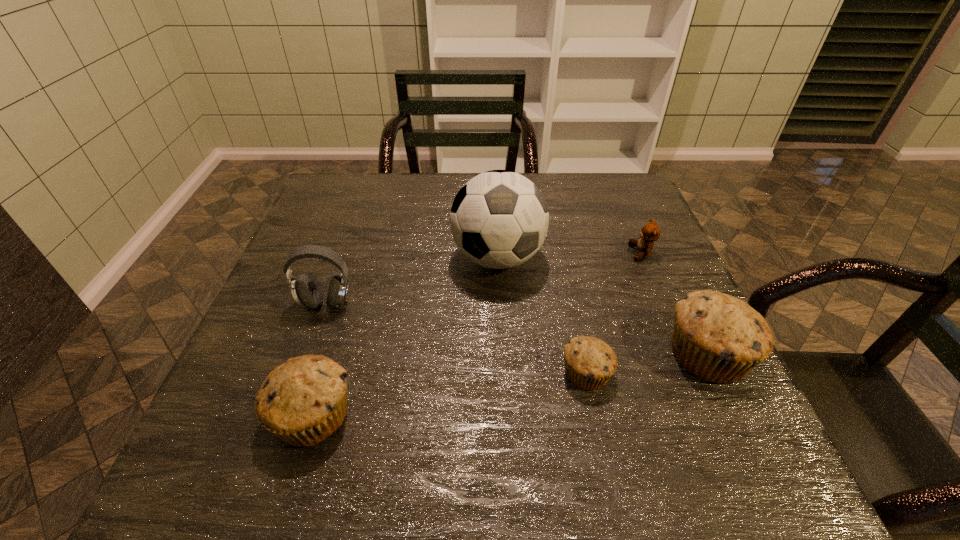
In order to click on the fourth tallest object in this screenshot , I will do `click(303, 401)`.

At what (x,y) coordinates should I click in order to perform the action: click on the second shortest muffin. Please return your answer as a coordinate pair (x, y). This screenshot has height=540, width=960. Looking at the image, I should click on (303, 401).

You are a GUI agent. You are given a task and a screenshot of the screen. Output one action in this format:
    pyautogui.click(x=<x>, y=<y>)
    Task: Click on the shortest muffin
    
    Given the screenshot: What is the action you would take?
    pyautogui.click(x=590, y=362)

Where is `the rightmost muffin`? The height and width of the screenshot is (540, 960). the rightmost muffin is located at coordinates (719, 338).

Identify the location of soccer ball. (499, 219).

The image size is (960, 540). Identify the location of teddy bear. (650, 232).

You are a GUI agent. You are given a task and a screenshot of the screen. Output one action in this format:
    pyautogui.click(x=<x>, y=<y>)
    Task: Click on the fourth nearest object
    The width and height of the screenshot is (960, 540).
    Given the screenshot: What is the action you would take?
    pyautogui.click(x=307, y=292)

This screenshot has height=540, width=960. Identify the location of vacant space located 0.050m on the back of the fourth tallest object. (330, 358).

The height and width of the screenshot is (540, 960). Identify the location of vacant space situated on the back of the second muffin from right to left. (564, 269).

You are a GUI agent. You are given a task and a screenshot of the screen. Output one action in this format:
    pyautogui.click(x=<x>, y=<y>)
    Task: Click on the vacant position located on the left of the rightmost muffin
    The image size is (960, 540).
    Given the screenshot: What is the action you would take?
    [x=565, y=354]